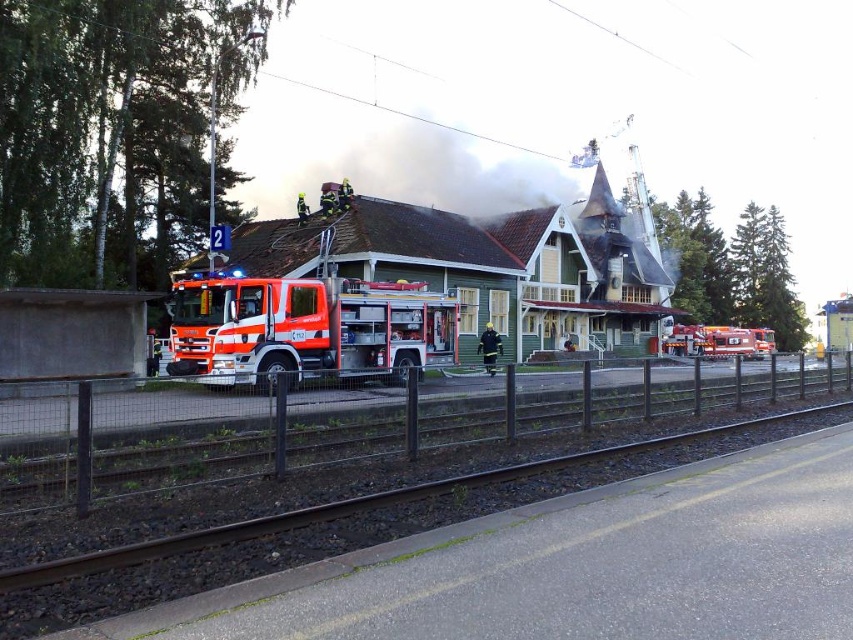
Is orange glossy fire truck at center taller than orange reflective fire truck at center?

Yes.

Is orange glossy fire truck at center thinner than orange reflective fire truck at center?

Yes, orange glossy fire truck at center is thinner than orange reflective fire truck at center.

Is point (442, 339) closer to viewer compared to point (694, 349)?

Yes, it is.

What are the coordinates of `orange glossy fire truck at center` in the screenshot? It's located at (306, 328).

Which is more to the left, metal fence at lower center or orange glossy fire truck at center?

From the viewer's perspective, orange glossy fire truck at center appears more on the left side.

Is metal fence at lower center shorter than orange glossy fire truck at center?

Yes.

Where is `metal fence at lower center`? metal fence at lower center is located at coordinates (177, 442).

Find the location of `green wooden railway station at center`. green wooden railway station at center is located at coordinates (488, 266).

Find the location of a particular element. This screenshot has height=640, width=853. green wooden railway station at center is located at coordinates (488, 266).